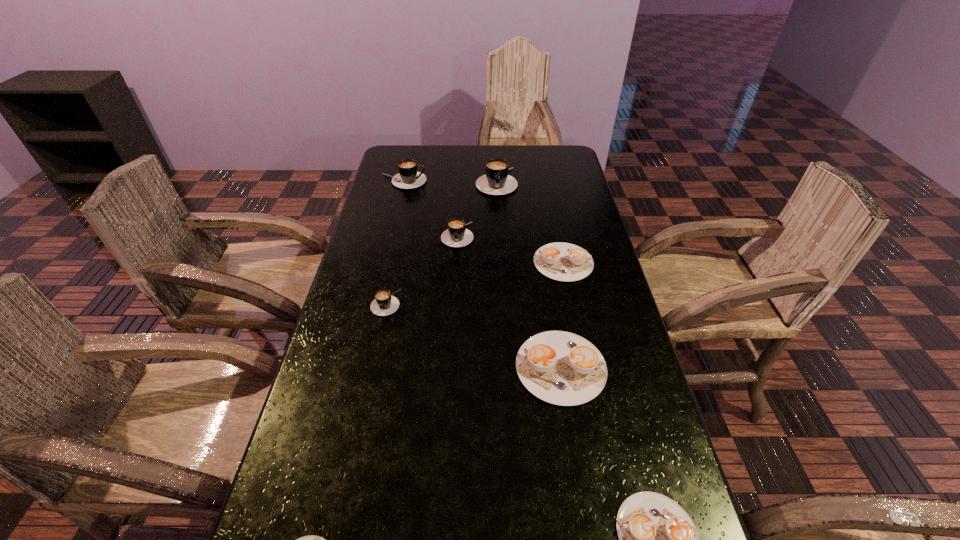
Locate an element on the screen. Image resolution: width=960 pixels, height=540 pixels. the biggest black cappuccino is located at coordinates (496, 181).

Find the location of a particular element. Image resolution: width=960 pixels, height=540 pixels. the tallest cappuccino is located at coordinates (496, 181).

Locate an element on the screen. This screenshot has height=540, width=960. the seventh shortest object is located at coordinates click(408, 177).

You are a GUI agent. You are given a task and a screenshot of the screen. Output one action in this format:
    pyautogui.click(x=<x>, y=<y>)
    Task: Click on the third smallest black cappuccino
    This screenshot has height=540, width=960.
    Given the screenshot: What is the action you would take?
    pyautogui.click(x=408, y=177)

Where is `the third tallest cappuccino`? The image size is (960, 540). the third tallest cappuccino is located at coordinates (456, 235).

Locate an element on the screen. Image resolution: width=960 pixels, height=540 pixels. the fifth cappuccino from right to left is located at coordinates (456, 235).

Locate an element on the screen. This screenshot has width=960, height=540. the nearest black cappuccino is located at coordinates (384, 304).

The height and width of the screenshot is (540, 960). What are the coordinates of `the smallest black cappuccino` in the screenshot? It's located at (384, 304).

Where is `the second farthest white cappuccino`? the second farthest white cappuccino is located at coordinates (561, 368).

You are a GUI agent. You are given a task and a screenshot of the screen. Output one action in this format:
    pyautogui.click(x=<x>, y=<y>)
    Task: Click on the third nearest cappuccino
    The image size is (960, 540).
    Given the screenshot: What is the action you would take?
    [x=561, y=368]